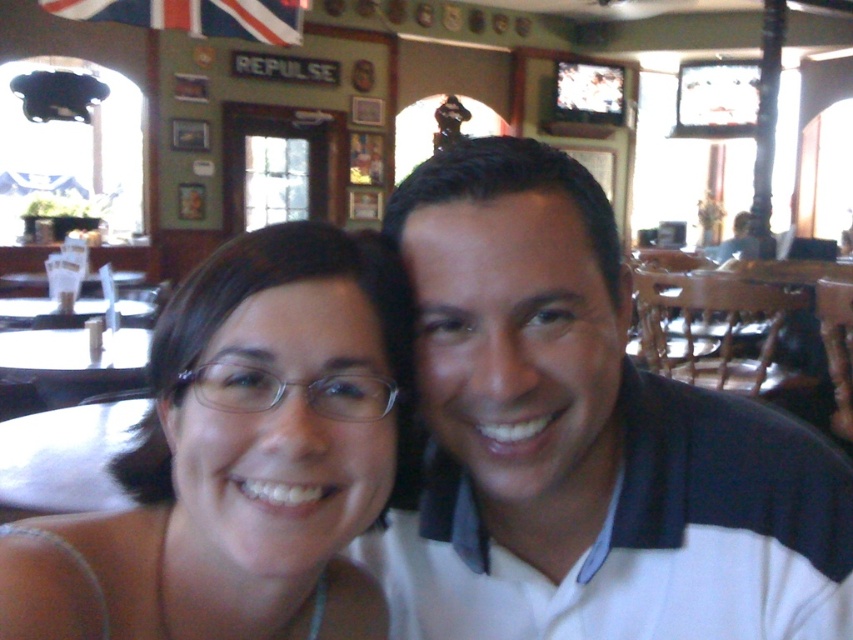
Who is taller, white cotton shirt at center or matte white glasses at center?

Standing taller between the two is white cotton shirt at center.

Between white cotton shirt at center and matte white glasses at center, which one has less height?

Standing shorter between the two is matte white glasses at center.

Is point (776, 524) closer to viewer compared to point (285, 282)?

No, (776, 524) is behind (285, 282).

Find the location of `white cotton shirt at center`. white cotton shirt at center is located at coordinates (584, 440).